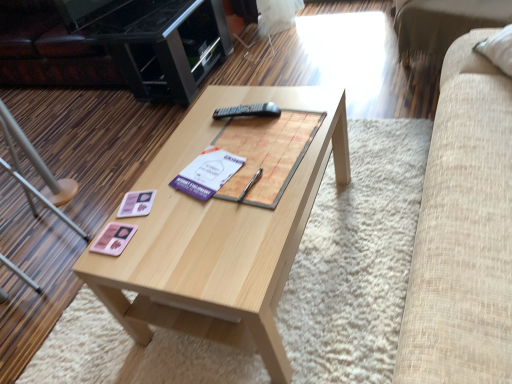
Find the location of a particular element. This screenshot has width=512, height=384. vacant space to the right of white paper at center is located at coordinates (261, 162).